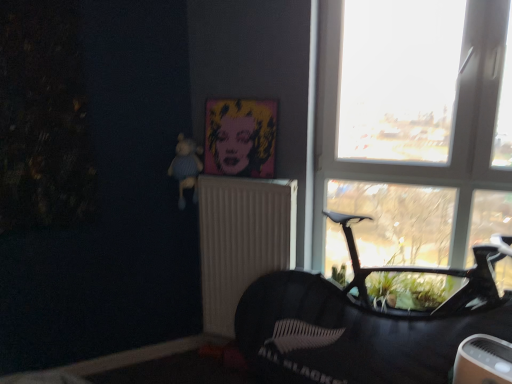
Where is `free space above white textured radiator at center (from a real-world perspective)`? free space above white textured radiator at center (from a real-world perspective) is located at coordinates (240, 173).